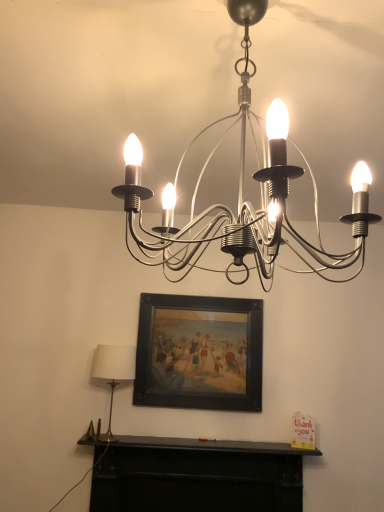
Question: Considering the relative positions of white fabric lampshade at left, the 1th lamp viewed from the back, and satin silver chandelier at upper center, which is counted as the 2th lamp, starting from the left, in the image provided, is white fabric lampshade at left, the 1th lamp viewed from the back, to the right of satin silver chandelier at upper center, which is counted as the 2th lamp, starting from the left, from the viewer's perspective?

Choices:
 (A) yes
 (B) no

Answer: (B)

Question: Is white fabric lampshade at left, arranged as the second lamp when viewed from the top, thinner than satin silver chandelier at upper center, arranged as the first lamp when viewed from the front?

Choices:
 (A) no
 (B) yes

Answer: (B)

Question: Is there a large distance between white fabric lampshade at left, arranged as the 2th lamp when viewed from the right, and satin silver chandelier at upper center, which is counted as the 2th lamp, starting from the left?

Choices:
 (A) yes
 (B) no

Answer: (A)

Question: Is white fabric lampshade at left, which appears as the first lamp when ordered from the bottom, outside satin silver chandelier at upper center, which is counted as the 2th lamp, starting from the left?

Choices:
 (A) no
 (B) yes

Answer: (B)

Question: Is white fabric lampshade at left, which appears as the first lamp when ordered from the bottom, at the left side of satin silver chandelier at upper center, marked as the 1th lamp in a right-to-left arrangement?

Choices:
 (A) no
 (B) yes

Answer: (B)

Question: Considering the relative positions of white fabric lampshade at left, arranged as the 2th lamp when viewed from the right, and satin silver chandelier at upper center, marked as the 1th lamp in a right-to-left arrangement, in the image provided, is white fabric lampshade at left, arranged as the 2th lamp when viewed from the right, in front of satin silver chandelier at upper center, marked as the 1th lamp in a right-to-left arrangement,?

Choices:
 (A) yes
 (B) no

Answer: (B)

Question: Can you confirm if black matte fireplace at lower center is wider than black wooden picture frame at center?

Choices:
 (A) no
 (B) yes

Answer: (B)

Question: Does black matte fireplace at lower center have a lesser width compared to black wooden picture frame at center?

Choices:
 (A) yes
 (B) no

Answer: (B)

Question: Is the depth of black matte fireplace at lower center greater than that of black wooden picture frame at center?

Choices:
 (A) no
 (B) yes

Answer: (A)

Question: Is black matte fireplace at lower center not within black wooden picture frame at center?

Choices:
 (A) no
 (B) yes

Answer: (B)

Question: Is black matte fireplace at lower center shorter than black wooden picture frame at center?

Choices:
 (A) yes
 (B) no

Answer: (A)

Question: Is black matte fireplace at lower center at the left side of black wooden picture frame at center?

Choices:
 (A) no
 (B) yes

Answer: (B)

Question: Is the depth of black matte fireplace at lower center greater than that of satin silver chandelier at upper center, the 2th lamp in the bottom-to-top sequence?

Choices:
 (A) yes
 (B) no

Answer: (A)